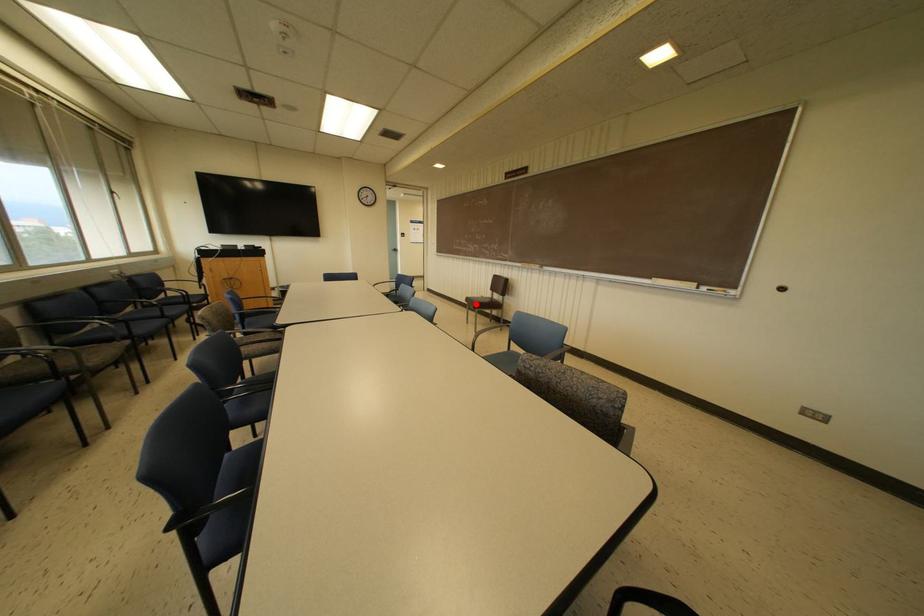
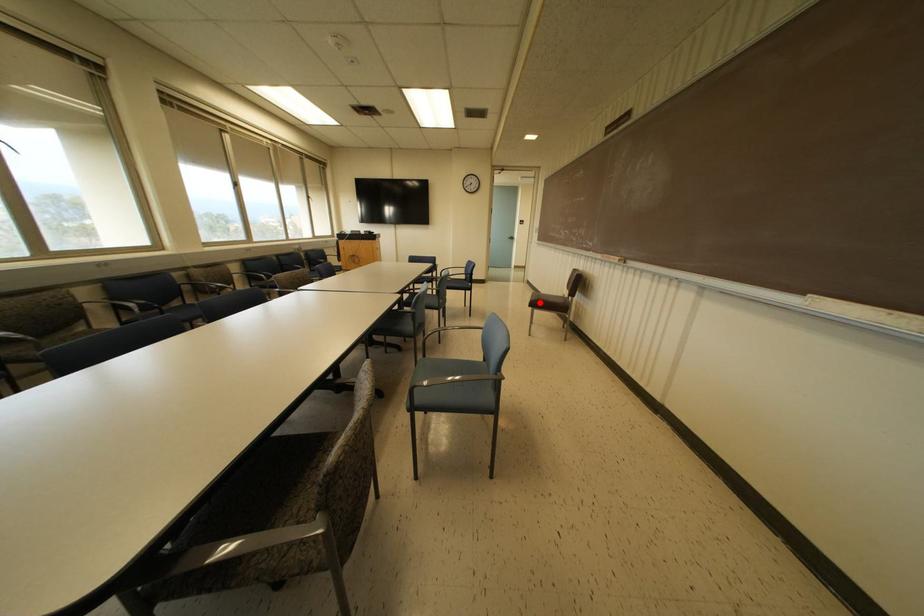
I am providing you with two images of the same scene from different viewpoints. A red point is marked on the first image and another point is marked on the second image. Is the red point in image1 aligned with the point shown in image2?

Yes